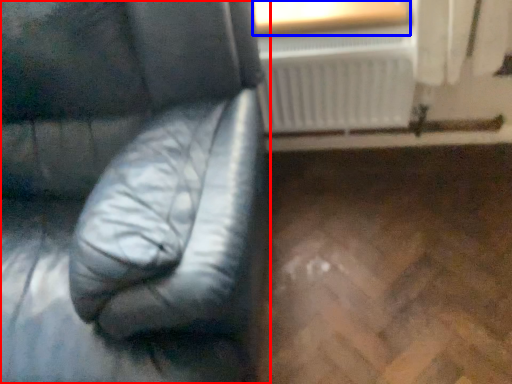
Question: Which point is closer to the camera, furniture (highlighted by a red box) or window frame (highlighted by a blue box)?

Choices:
 (A) furniture
 (B) window frame

Answer: (A)